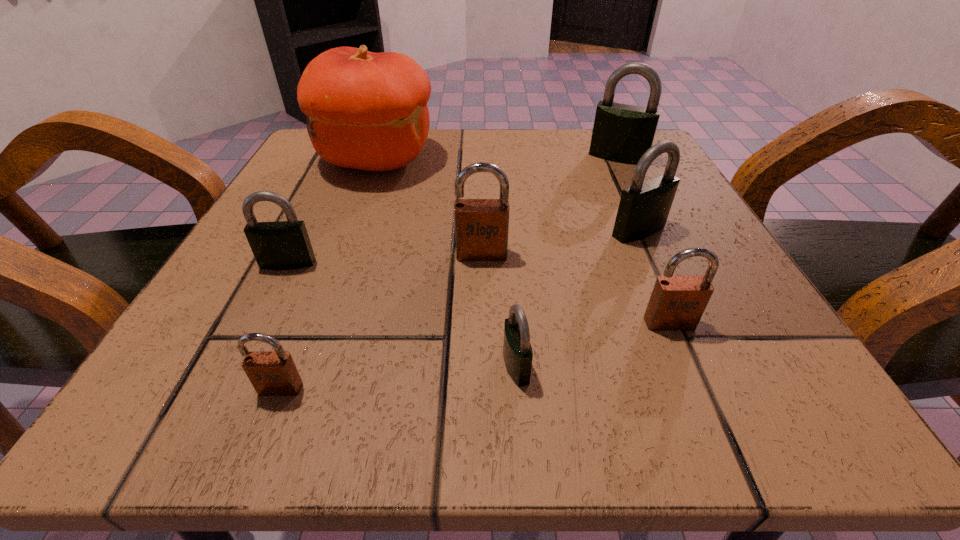
Identify the location of free point between the rightmost brown padlock and the smallest brown padlock. Image resolution: width=960 pixels, height=540 pixels. (475, 356).

The height and width of the screenshot is (540, 960). In order to click on free space between the leftmost black padlock and the second smallest brown padlock in this screenshot , I will do `click(478, 293)`.

In order to click on free space that is in between the third black padlock from right to left and the second nearest brown padlock in this screenshot , I will do `click(592, 345)`.

You are a GUI agent. You are given a task and a screenshot of the screen. Output one action in this format:
    pyautogui.click(x=<x>, y=<y>)
    Task: Click on the free spot between the tallest padlock and the third black padlock from right to left
    This screenshot has width=960, height=540.
    Given the screenshot: What is the action you would take?
    pyautogui.click(x=567, y=261)

Select which object is the seventh closest to the farthest padlock. Please provide its 2D coordinates. Your answer should be formatted as a tuple, i.e. [(x, y)], where the tuple contains the x and y coordinates of a point satisfying the conditions above.

[(272, 373)]

Point out which object is positioned as the nearest to the biggest black padlock. Please provide its 2D coordinates. Your answer should be formatted as a tuple, i.e. [(x, y)], where the tuple contains the x and y coordinates of a point satisfying the conditions above.

[(644, 207)]

This screenshot has height=540, width=960. In order to click on padlock that stands as the third closest to the pumpkin in this screenshot , I will do `click(644, 207)`.

Identify which padlock is located as the third nearest to the seventh shortest object. Please provide its 2D coordinates. Your answer should be formatted as a tuple, i.e. [(x, y)], where the tuple contains the x and y coordinates of a point satisfying the conditions above.

[(677, 302)]

Choose which black padlock is the nearest neighbor to the second brown padlock from right to left. Please provide its 2D coordinates. Your answer should be formatted as a tuple, i.e. [(x, y)], where the tuple contains the x and y coordinates of a point satisfying the conditions above.

[(517, 351)]

Where is `black padlock that is the fourth closest to the farthest brown padlock`? Image resolution: width=960 pixels, height=540 pixels. black padlock that is the fourth closest to the farthest brown padlock is located at coordinates (622, 133).